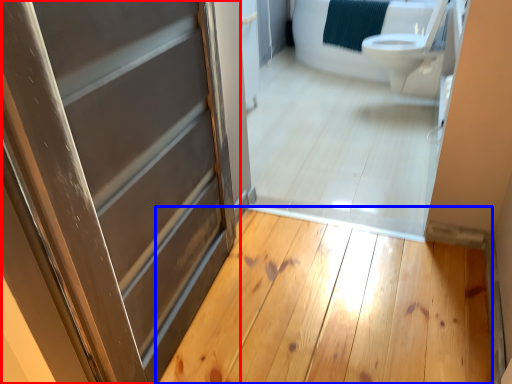
Question: Which point is further to the camera, door (highlighted by a red box) or plank (highlighted by a blue box)?

Choices:
 (A) door
 (B) plank

Answer: (B)